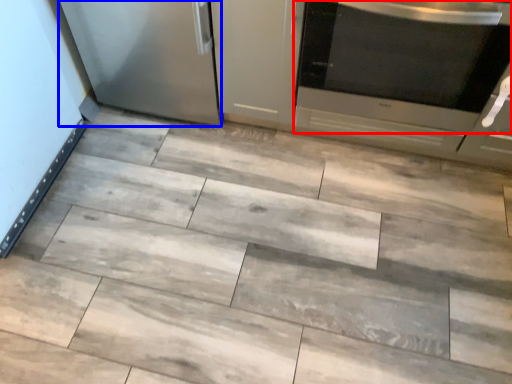
Question: Which object is closer to the camera taking this photo, home appliance (highlighted by a red box) or appliance (highlighted by a blue box)?

Choices:
 (A) home appliance
 (B) appliance

Answer: (A)